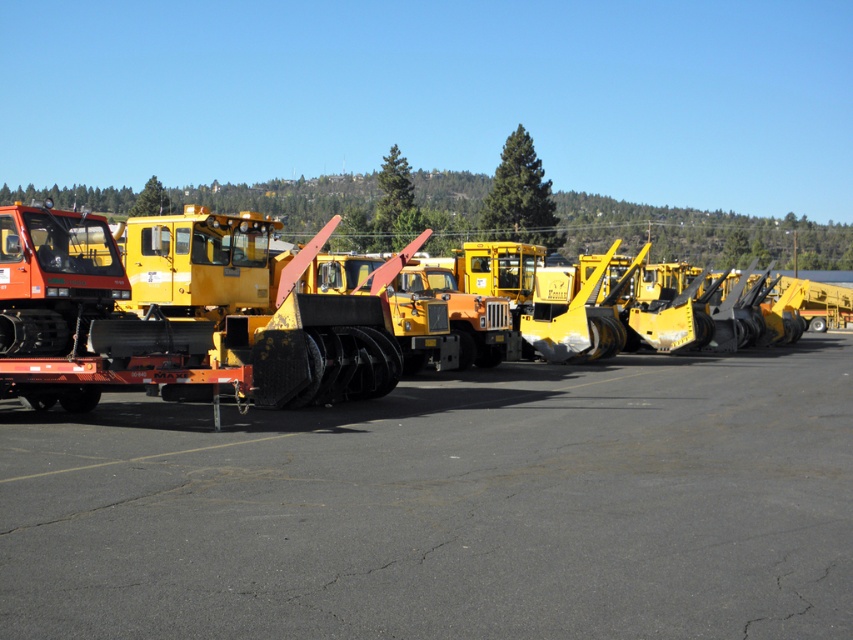
Is black asphalt at center to the left of matte black snowplow at left from the viewer's perspective?

In fact, black asphalt at center is to the right of matte black snowplow at left.

Is point (555, 483) less distant than point (225, 275)?

Yes, point (555, 483) is closer to viewer.

Where is `black asphalt at center`? Image resolution: width=853 pixels, height=640 pixels. black asphalt at center is located at coordinates (448, 508).